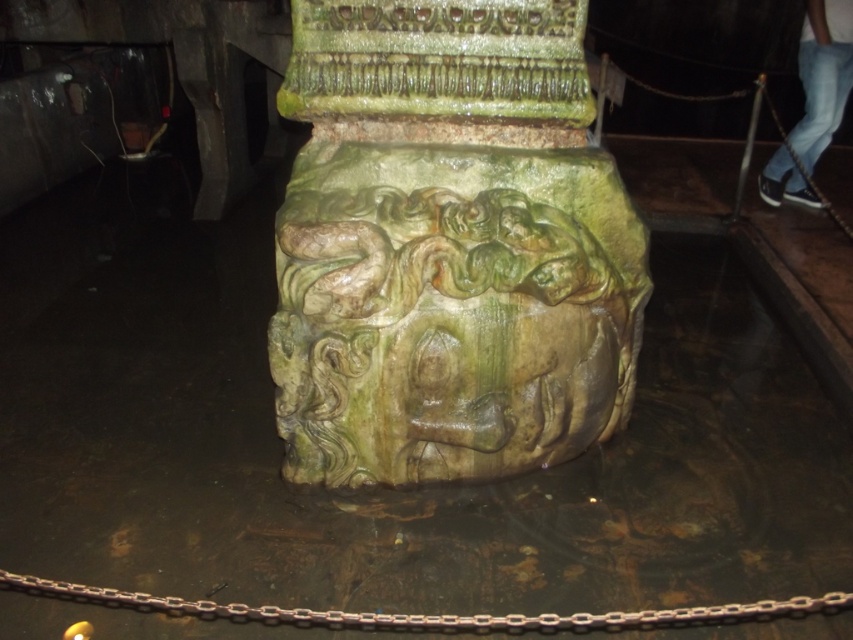
Who is more forward, (337, 161) or (805, 99)?

Point (337, 161)

Between green marble statue at center and jeans at lower right, which one appears on the right side from the viewer's perspective?

From the viewer's perspective, jeans at lower right appears more on the right side.

Locate an element on the screen. green marble statue at center is located at coordinates (448, 244).

Does green marble statue at center appear on the right side of rusty metal chain at lower center?

Indeed, green marble statue at center is positioned on the right side of rusty metal chain at lower center.

Is green marble statue at center shorter than rusty metal chain at lower center?

Incorrect, green marble statue at center's height does not fall short of rusty metal chain at lower center's.

At what (x,y) coordinates should I click in order to perform the action: click on green marble statue at center. Please return your answer as a coordinate pair (x, y). Looking at the image, I should click on [x=448, y=244].

Who is more forward, (762, 612) or (819, 93)?

Point (762, 612)

What are the coordinates of `rusty metal chain at lower center` in the screenshot? It's located at (431, 614).

At what (x,y) coordinates should I click in order to perform the action: click on rusty metal chain at lower center. Please return your answer as a coordinate pair (x, y). The width and height of the screenshot is (853, 640). Looking at the image, I should click on (431, 614).